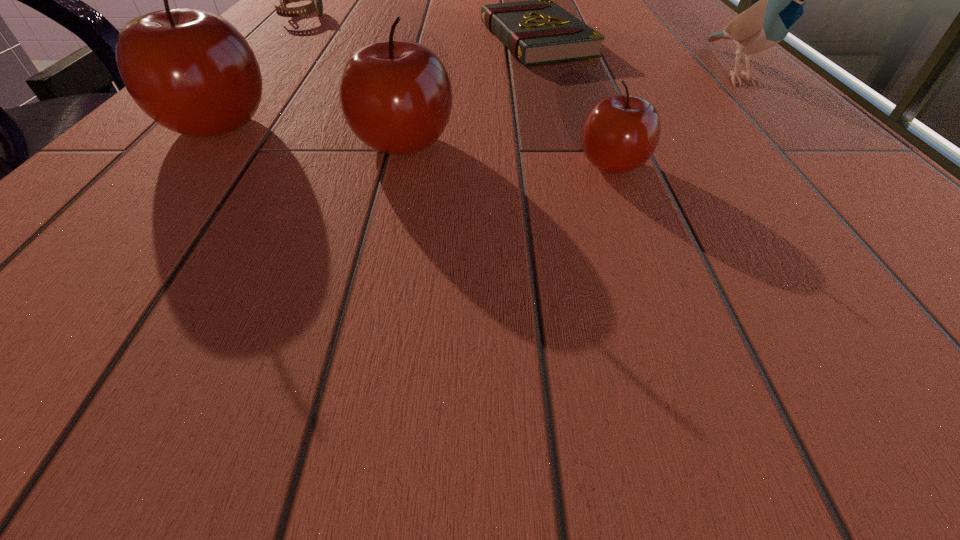
Where is `blank space at the near left corner of the desktop`? This screenshot has width=960, height=540. blank space at the near left corner of the desktop is located at coordinates (162, 227).

Identify the location of vacant region at the near right corner of the desktop. The width and height of the screenshot is (960, 540). (871, 284).

Locate an element on the screen. The width and height of the screenshot is (960, 540). vacant area that lies between the bird and the shortest apple is located at coordinates (674, 119).

Identify the location of unoccupied area between the shortest apple and the book. This screenshot has width=960, height=540. (575, 102).

Find the location of a particular element. vacant area that lies between the rightmost apple and the bird is located at coordinates (674, 119).

At what (x,y) coordinates should I click in order to perform the action: click on blank region between the shortest object and the rightmost object. Please return your answer as a coordinate pair (x, y). The image size is (960, 540). Looking at the image, I should click on (636, 57).

Find the location of a particular element. The width and height of the screenshot is (960, 540). free space between the rightmost apple and the watch is located at coordinates (458, 91).

Locate an element on the screen. This screenshot has width=960, height=540. free space between the leftmost apple and the bird is located at coordinates (476, 100).

This screenshot has width=960, height=540. Identify the location of unoccupied area between the third tallest object and the leftmost apple. (310, 134).

Identify which object is the fifth closest to the bird. Please provide its 2D coordinates. Your answer should be formatted as a tuple, i.e. [(x, y)], where the tuple contains the x and y coordinates of a point satisfying the conditions above.

[(316, 6)]